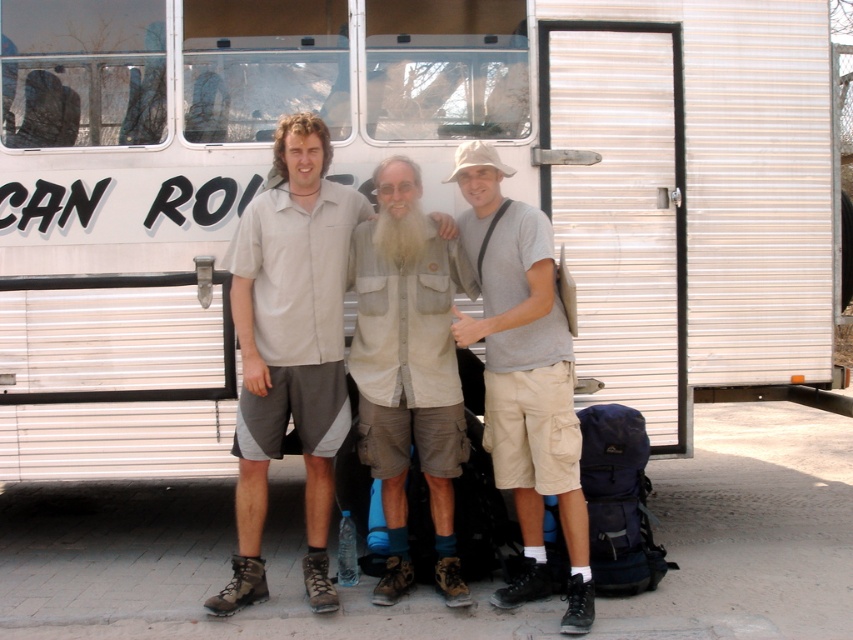
You are standing in front of the large vehicle and want to find the light beige shirt at center. Where should you look relative to the vehicle?

The light beige shirt at center is located at the point 0.544 on the x axis and 0.340 on the y axis relative to the vehicle.